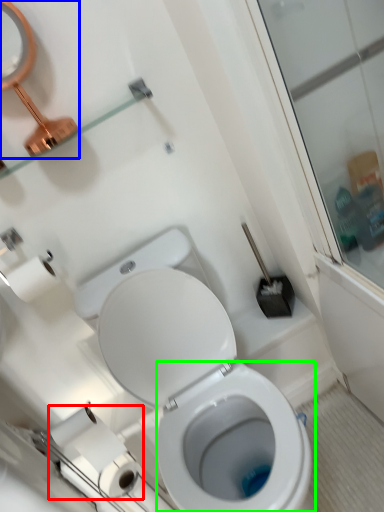
Question: Which is farther away from toilet paper (highlighted by a red box)? mirror (highlighted by a blue box) or bidet (highlighted by a green box)?

Choices:
 (A) mirror
 (B) bidet

Answer: (A)